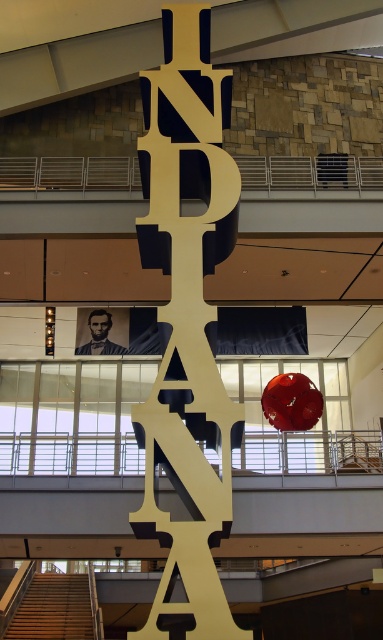
Question: Which object is farther from the camera taking this photo?

Choices:
 (A) gold metallic letters at center
 (B) smooth skin portrait at center

Answer: (B)

Question: Can you confirm if gold metallic letters at center is positioned to the right of smooth skin portrait at center?

Choices:
 (A) yes
 (B) no

Answer: (A)

Question: Does gold metallic letters at center come behind smooth skin portrait at center?

Choices:
 (A) no
 (B) yes

Answer: (A)

Question: Which object appears closest to the camera in this image?

Choices:
 (A) smooth skin portrait at center
 (B) gold metallic letters at center

Answer: (B)

Question: Can you confirm if gold metallic letters at center is positioned below smooth skin portrait at center?

Choices:
 (A) yes
 (B) no

Answer: (B)